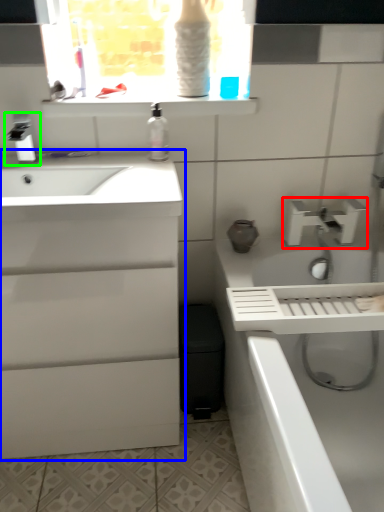
Question: Which object is the closest to the tap (highlighted by a red box)? Choose among these: bathroom cabinet (highlighted by a blue box) or tap (highlighted by a green box).

Choices:
 (A) bathroom cabinet
 (B) tap

Answer: (A)